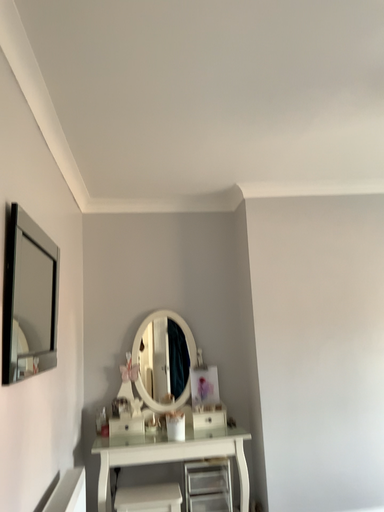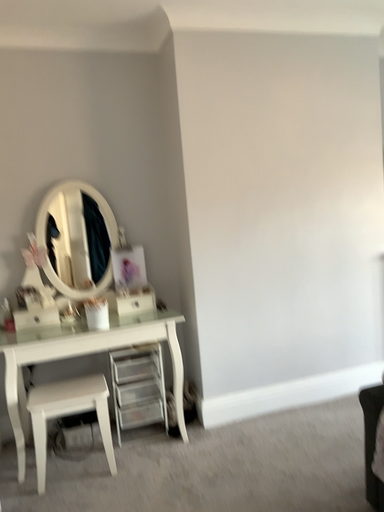
Question: How did the camera likely rotate when shooting the video?

Choices:
 (A) rotated right
 (B) rotated left

Answer: (A)